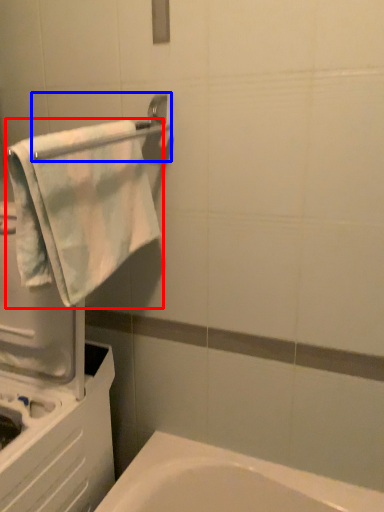
Question: Among these objects, which one is farthest to the camera, towel (highlighted by a red box) or towel bar (highlighted by a blue box)?

Choices:
 (A) towel
 (B) towel bar

Answer: (A)